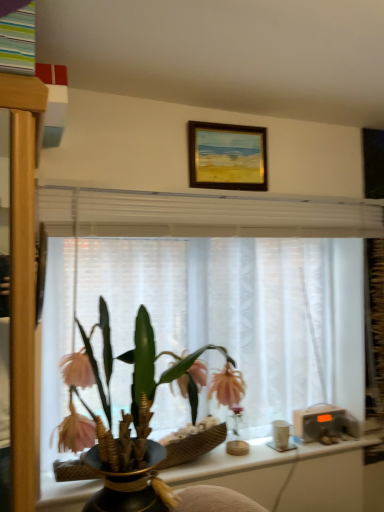
Question: Considering the relative sizes of matte black vase at center and transparent glass vase at center in the image provided, is matte black vase at center smaller than transparent glass vase at center?

Choices:
 (A) no
 (B) yes

Answer: (A)

Question: Is matte black vase at center further to camera compared to transparent glass vase at center?

Choices:
 (A) no
 (B) yes

Answer: (A)

Question: Is matte black vase at center not near transparent glass vase at center?

Choices:
 (A) no
 (B) yes

Answer: (A)

Question: Can you confirm if matte black vase at center is thinner than transparent glass vase at center?

Choices:
 (A) no
 (B) yes

Answer: (A)

Question: Would you say transparent glass vase at center is part of matte black vase at center's contents?

Choices:
 (A) yes
 (B) no

Answer: (B)

Question: From a real-world perspective, is matte black vase at center positioned over transparent glass vase at center based on gravity?

Choices:
 (A) yes
 (B) no

Answer: (A)

Question: Can you confirm if matte black vase at center is smaller than white matte cup at right?

Choices:
 (A) no
 (B) yes

Answer: (A)

Question: Is matte black vase at center bigger than white matte cup at right?

Choices:
 (A) no
 (B) yes

Answer: (B)

Question: Is matte black vase at center next to white matte cup at right?

Choices:
 (A) no
 (B) yes

Answer: (A)

Question: From the image's perspective, is matte black vase at center on top of white matte cup at right?

Choices:
 (A) yes
 (B) no

Answer: (A)

Question: From a real-world perspective, is matte black vase at center over white matte cup at right?

Choices:
 (A) yes
 (B) no

Answer: (A)

Question: Can you confirm if matte black vase at center is thinner than white matte cup at right?

Choices:
 (A) no
 (B) yes

Answer: (A)

Question: Is white matte cup at right touching white sheer curtain at center?

Choices:
 (A) yes
 (B) no

Answer: (B)